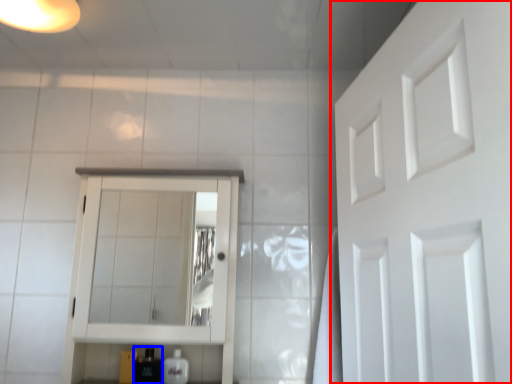
Question: Which of the following is the farthest to the observer, door (highlighted by a red box) or toiletry (highlighted by a blue box)?

Choices:
 (A) door
 (B) toiletry

Answer: (B)